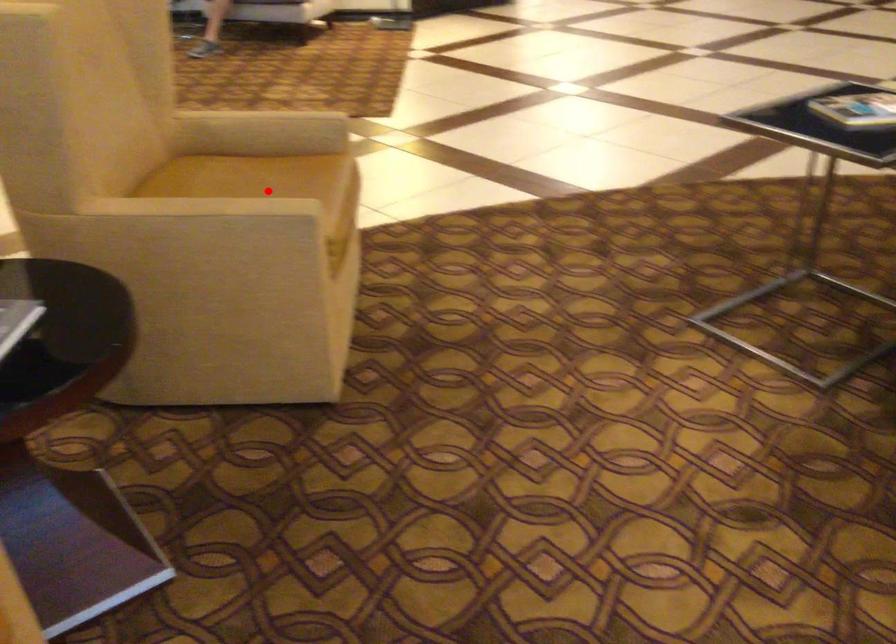
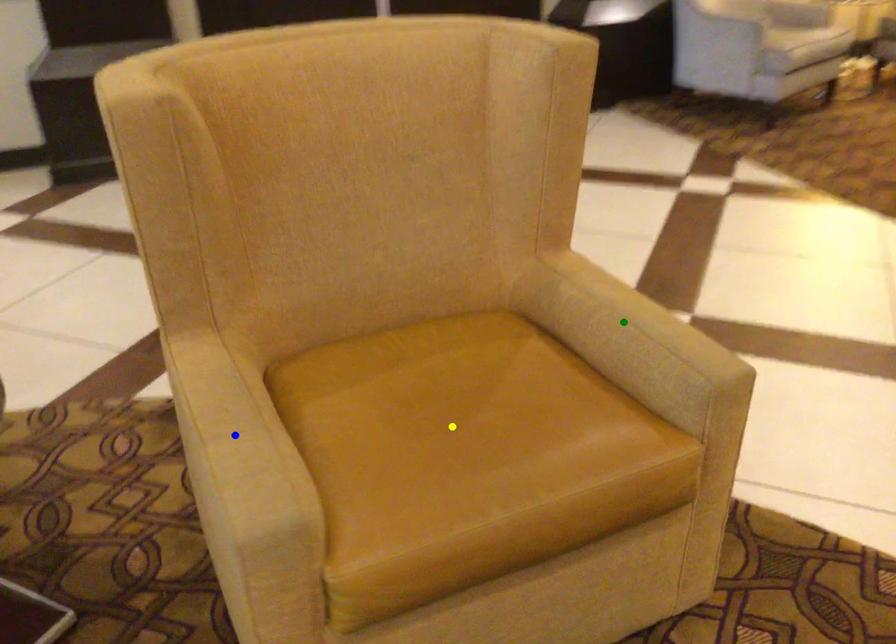
Question: I am providing you with two images of the same scene from different viewpoints. A red point is marked on the first image. You are given multiple points on the second image. In image 2, which mark is for the same physical point as the one in image 1?

Choices:
 (A) green point
 (B) yellow point
 (C) blue point

Answer: (B)